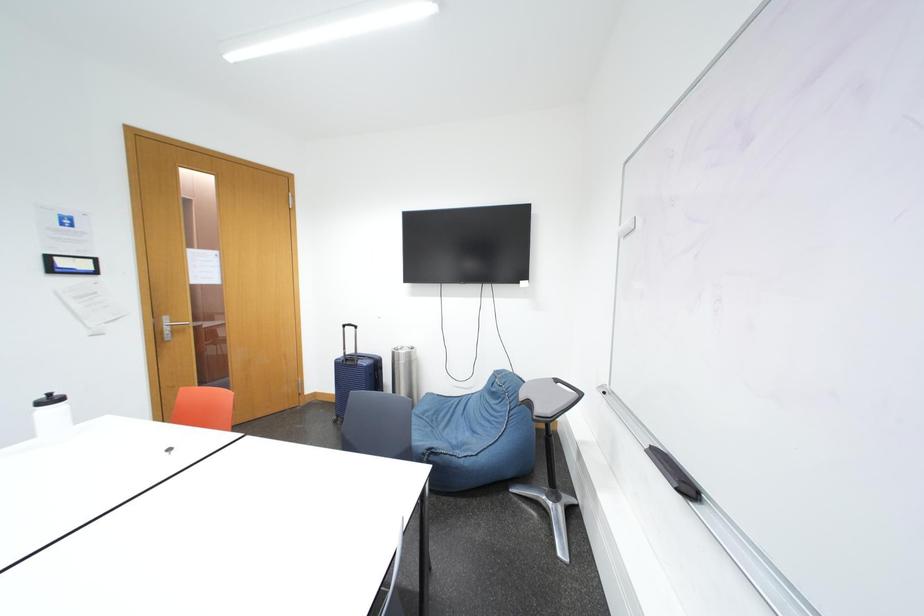
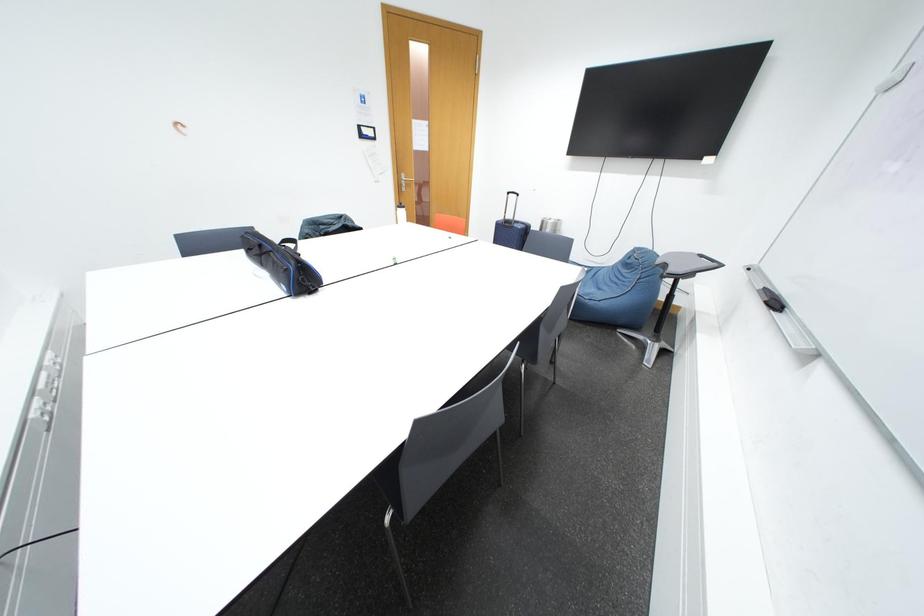
First-person continuous shooting, in which direction is the camera rotating?

The camera rotated toward left-down.